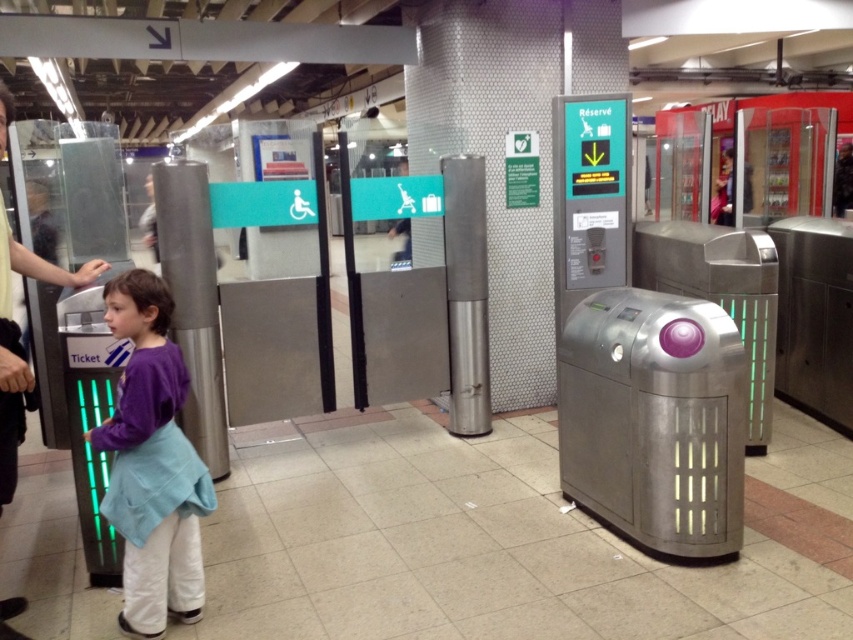
Which is in front, point (129, 634) or point (184, 180)?

Point (129, 634) is more forward.

Where is `purple fabric dress at left`? The image size is (853, 640). purple fabric dress at left is located at coordinates (152, 464).

The height and width of the screenshot is (640, 853). In order to click on purple fabric dress at left in this screenshot , I will do `click(152, 464)`.

Is silver metallic pillar at center thinner than dark gray shirt at left?

Correct, silver metallic pillar at center's width is less than dark gray shirt at left's.

Does silver metallic pillar at center have a greater height compared to dark gray shirt at left?

Correct, silver metallic pillar at center is much taller as dark gray shirt at left.

What do you see at coordinates (193, 301) in the screenshot? The image size is (853, 640). I see `silver metallic pillar at center` at bounding box center [193, 301].

In order to click on silver metallic pillar at center in this screenshot , I will do `click(193, 301)`.

Is point (154, 570) positioned behind point (7, 285)?

That is True.

Is purple fabric dress at left to the left of dark gray shirt at left from the viewer's perspective?

In fact, purple fabric dress at left is to the right of dark gray shirt at left.

I want to click on purple fabric dress at left, so click(152, 464).

You are a GUI agent. You are given a task and a screenshot of the screen. Output one action in this format:
    pyautogui.click(x=<x>, y=<y>)
    Task: Click on the purple fabric dress at left
    The width and height of the screenshot is (853, 640).
    Given the screenshot: What is the action you would take?
    pyautogui.click(x=152, y=464)